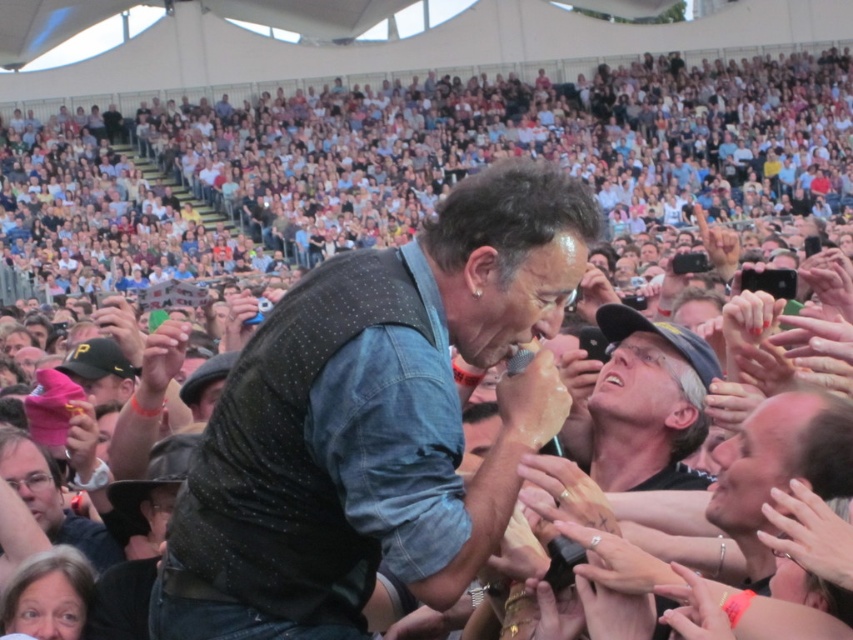
You are a photographer at the concert and want to take a clear photo of both the denim vest at center and the gray fabric cap at center. Which object will appear larger in the photo?

The denim vest at center will appear larger in the photo because it is closer to the viewer than the gray fabric cap at center.

You are a stagehand at the concert and need to ensure the performer stays within the safety zone marked on the stage. The safety zone has a radius of 4 meters. Given the distance between the denim vest at center and the gray fabric cap at center, is the performer currently within the safety zone?

The distance between the denim vest at center and the gray fabric cap at center is 4.68 meters, which exceeds the 4 meter safety zone radius. Therefore, the performer is outside the safety zone.